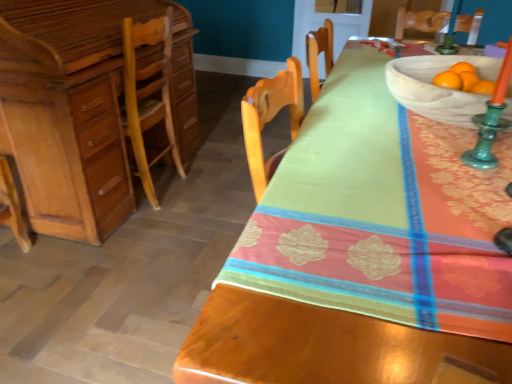
This screenshot has height=384, width=512. I want to click on light brown wood desk at left, so click(x=78, y=108).

In terms of height, does natural wood bowl at upper right look taller or shorter compared to matte wood desk at left?

Clearly, natural wood bowl at upper right is shorter compared to matte wood desk at left.

Is natural wood bowl at upper right far from matte wood desk at left?

No, there isn't a large distance between natural wood bowl at upper right and matte wood desk at left.

Is natural wood bowl at upper right further to camera compared to matte wood desk at left?

Yes, it is.

Looking at this image, could you tell me if natural wood bowl at upper right is turned towards matte wood desk at left?

No, natural wood bowl at upper right is not facing towards matte wood desk at left.

Is light brown wood desk at left positioned behind natural wood bowl at upper right?

Yes, it is behind natural wood bowl at upper right.

Does light brown wood desk at left turn towards natural wood bowl at upper right?

Yes, light brown wood desk at left faces towards natural wood bowl at upper right.

Between light brown wood desk at left and natural wood bowl at upper right, which one has smaller width?

natural wood bowl at upper right.

Which object is positioned more to the left, light brown wood desk at left or natural wood bowl at upper right?

Positioned to the left is light brown wood desk at left.

Is matte wood desk at left not within light brown wood desk at left?

Yes, matte wood desk at left is not within light brown wood desk at left.

Which of these two, matte wood desk at left or light brown wood desk at left, is bigger?

Bigger between the two is matte wood desk at left.

From a real-world perspective, which is physically below, matte wood desk at left or light brown wood desk at left?

From a 3D spatial view, matte wood desk at left is below.

Is matte wood desk at left in front of or behind light brown wood desk at left in the image?

Visually, matte wood desk at left is located in front of light brown wood desk at left.

Is light brown wood desk at left behind matte wood desk at left?

Yes, it is.

From the image's perspective, between light brown wood desk at left and matte wood desk at left, which one is located above?

light brown wood desk at left is shown above in the image.

Measure the distance between light brown wood desk at left and matte wood desk at left.

They are 4.16 feet apart.

Between light brown wood desk at left and matte wood desk at left, which one has larger size?

matte wood desk at left.

Can we say natural wood bowl at upper right lies outside light brown wood desk at left?

natural wood bowl at upper right lies outside light brown wood desk at left's area.

Is natural wood bowl at upper right facing away from light brown wood desk at left?

Yes, light brown wood desk at left is at the back of natural wood bowl at upper right.

From the picture: From a real-world perspective, is natural wood bowl at upper right above or below light brown wood desk at left?

natural wood bowl at upper right is situated higher than light brown wood desk at left in the real world.

Is matte wood desk at left smaller than natural wood bowl at upper right?

Actually, matte wood desk at left might be larger than natural wood bowl at upper right.

How distant is matte wood desk at left from natural wood bowl at upper right?

matte wood desk at left and natural wood bowl at upper right are 14.96 inches apart.

Is matte wood desk at left inside or outside of natural wood bowl at upper right?

matte wood desk at left exists outside the volume of natural wood bowl at upper right.

Considering the sizes of objects matte wood desk at left and natural wood bowl at upper right in the image provided, who is taller, matte wood desk at left or natural wood bowl at upper right?

With more height is matte wood desk at left.

The width and height of the screenshot is (512, 384). I want to click on desk below the natural wood bowl at upper right (from the image's perspective), so click(365, 253).

In order to click on cabinetry that is behind the natural wood bowl at upper right in this screenshot , I will do `click(78, 108)`.

Looking at the image, which one is located further to light brown wood desk at left, matte wood desk at left or natural wood bowl at upper right?

natural wood bowl at upper right is positioned further to the anchor light brown wood desk at left.

Estimate the real-world distances between objects in this image. Which object is further from matte wood desk at left, light brown wood desk at left or natural wood bowl at upper right?

The object further to matte wood desk at left is light brown wood desk at left.

Looking at this image, which object lies further to the anchor point natural wood bowl at upper right, matte wood desk at left or light brown wood desk at left?

light brown wood desk at left is positioned further to the anchor natural wood bowl at upper right.

Looking at the image, which one is located further to light brown wood desk at left, natural wood bowl at upper right or matte wood desk at left?

natural wood bowl at upper right is positioned further to the anchor light brown wood desk at left.

When comparing their distances from matte wood desk at left, does natural wood bowl at upper right or light brown wood desk at left seem further?

Among the two, light brown wood desk at left is located further to matte wood desk at left.

Looking at this image, considering their positions, is light brown wood desk at left positioned closer to natural wood bowl at upper right than matte wood desk at left?

Based on the image, matte wood desk at left appears to be nearer to natural wood bowl at upper right.

The height and width of the screenshot is (384, 512). Identify the location of bowl situated between light brown wood desk at left and matte wood desk at left from left to right. click(x=438, y=87).